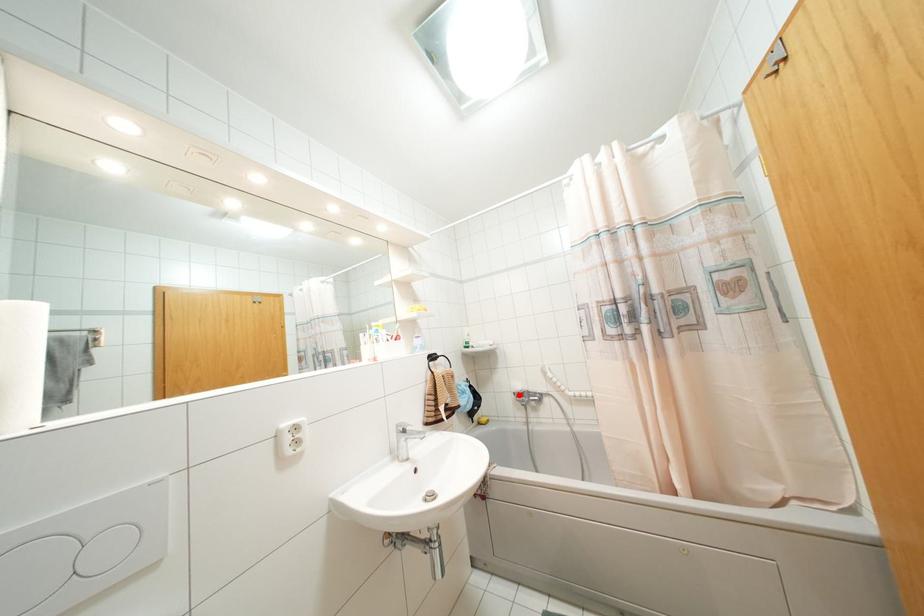
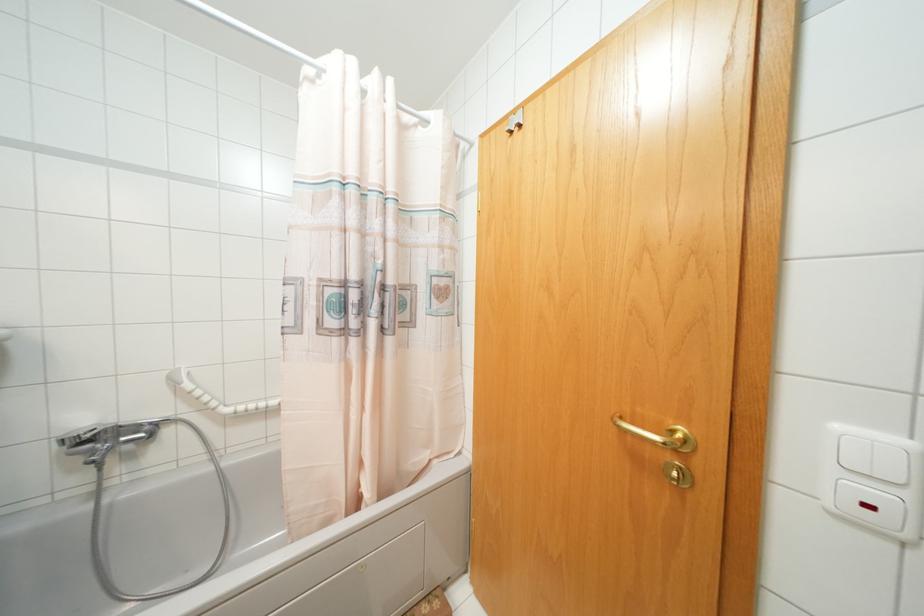
Question: I am providing you with two images of the same scene from different viewpoints. In image1, a red point is highlighted. Considering the same 3D point in image2, which of the following is correct?

Choices:
 (A) It is closer
 (B) It is farther

Answer: (A)